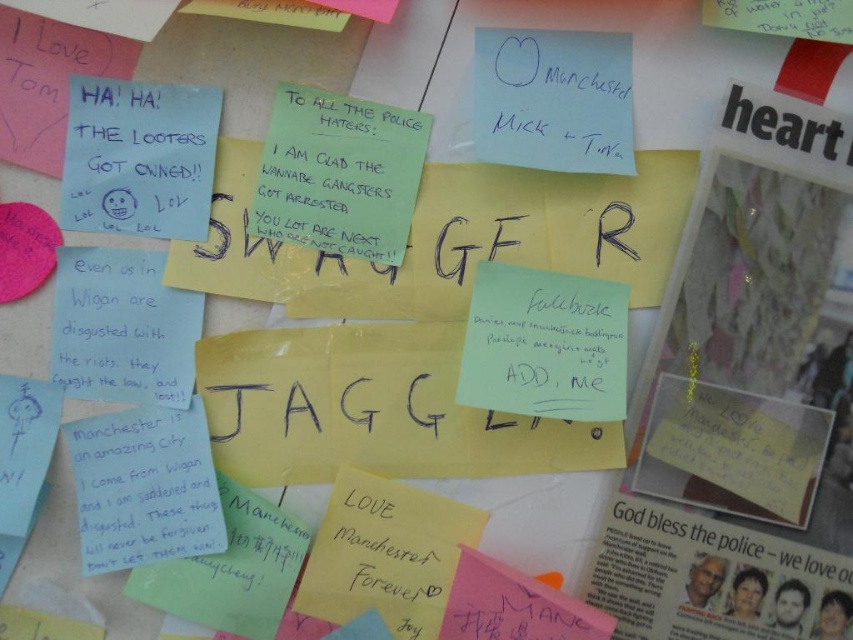
Question: Which of the following is the closest to the observer?

Choices:
 (A) (740, 616)
 (B) (254, 224)

Answer: (A)

Question: Is yellow paper note at upper right closer to camera compared to green paper note at center?

Choices:
 (A) yes
 (B) no

Answer: (A)

Question: Which object is farther from the camera taking this photo?

Choices:
 (A) green paper note at center
 (B) yellow paper note at upper right

Answer: (A)

Question: Is yellow paper note at upper right closer to camera compared to green paper note at center?

Choices:
 (A) no
 (B) yes

Answer: (B)

Question: Among these objects, which one is nearest to the camera?

Choices:
 (A) yellow paper note at upper right
 (B) green paper note at center

Answer: (A)

Question: In this image, where is yellow paper note at upper right located relative to green paper note at center?

Choices:
 (A) left
 (B) right

Answer: (B)